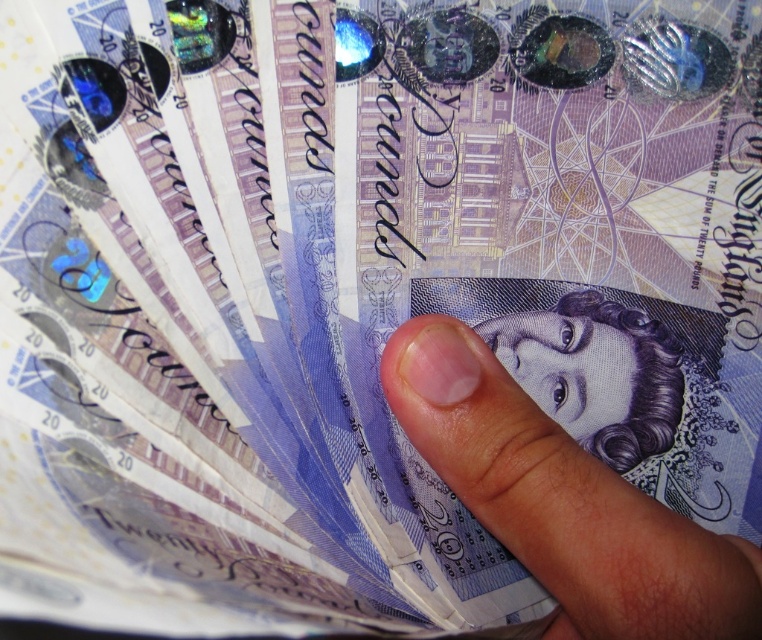
Question: Is flesh-toned skin at center positioned in front of purple paper money at center?

Choices:
 (A) yes
 (B) no

Answer: (A)

Question: Which object appears farthest from the camera in this image?

Choices:
 (A) purple paper money at center
 (B) flesh-toned skin at center

Answer: (A)

Question: Which of the following is the closest to the observer?

Choices:
 (A) (568, 326)
 (B) (602, 568)

Answer: (B)

Question: Is flesh-toned skin at center wider than purple paper money at center?

Choices:
 (A) no
 (B) yes

Answer: (B)

Question: Can you confirm if flesh-toned skin at center is smaller than purple paper money at center?

Choices:
 (A) yes
 (B) no

Answer: (B)

Question: Among these points, which one is farthest from the camera?

Choices:
 (A) (658, 604)
 (B) (642, 444)

Answer: (B)